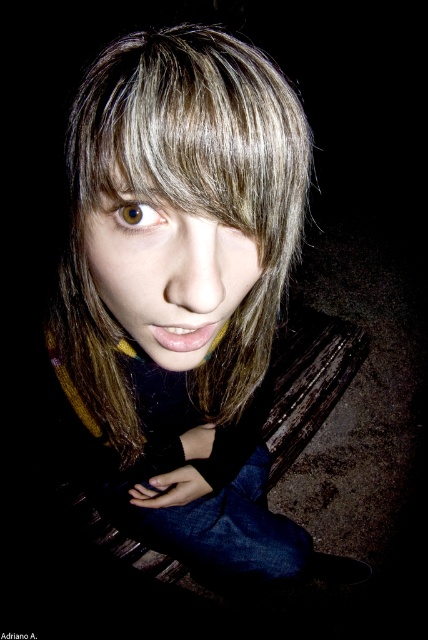
Question: Is smooth brown hair at center closer to camera compared to smooth skin face at center?

Choices:
 (A) yes
 (B) no

Answer: (A)

Question: Which of these objects is positioned farthest from the smooth skin face at center?

Choices:
 (A) smooth brown hair at center
 (B) brown matte eye at center

Answer: (A)

Question: Which is nearer to the brown matte eye at center?

Choices:
 (A) smooth brown hair at center
 (B) smooth skin face at center

Answer: (B)

Question: Is smooth brown hair at center closer to camera compared to brown matte eye at center?

Choices:
 (A) yes
 (B) no

Answer: (A)

Question: Is smooth skin face at center to the right of brown matte eye at center from the viewer's perspective?

Choices:
 (A) yes
 (B) no

Answer: (A)

Question: Which object appears closest to the camera in this image?

Choices:
 (A) smooth brown hair at center
 (B) brown matte eye at center
 (C) smooth skin face at center

Answer: (A)